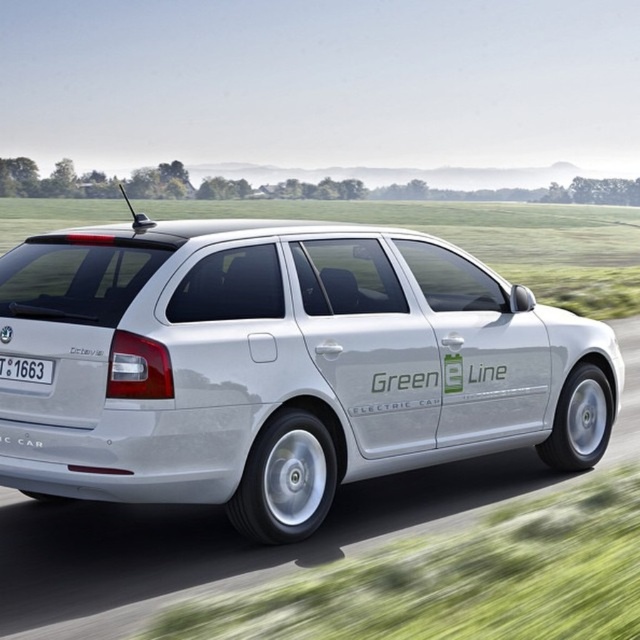
Question: Does white metallic car at center have a greater width compared to white plastic license plate at rear?

Choices:
 (A) no
 (B) yes

Answer: (B)

Question: Which point is farther to the camera?

Choices:
 (A) (176, 420)
 (B) (35, 372)

Answer: (B)

Question: Which object is farther from the camera taking this photo?

Choices:
 (A) white metallic car at center
 (B) white plastic license plate at rear

Answer: (A)

Question: Is white metallic car at center to the left of white plastic license plate at rear from the viewer's perspective?

Choices:
 (A) yes
 (B) no

Answer: (B)

Question: Which object appears closest to the camera in this image?

Choices:
 (A) white plastic license plate at rear
 (B) white metallic car at center

Answer: (A)

Question: Does white metallic car at center have a smaller size compared to white plastic license plate at rear?

Choices:
 (A) no
 (B) yes

Answer: (A)